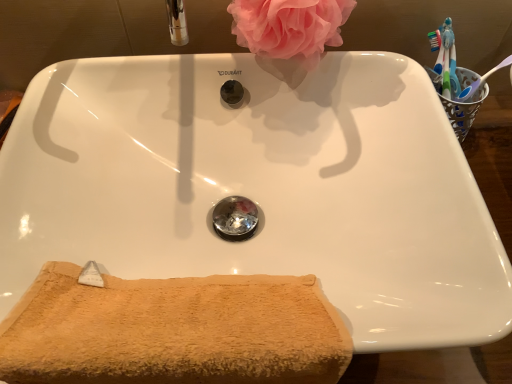
Question: Considering the positions of pink fluffy sponge at upper center and beige terry cloth towel at lower left in the image, is pink fluffy sponge at upper center taller or shorter than beige terry cloth towel at lower left?

Choices:
 (A) tall
 (B) short

Answer: (B)

Question: In terms of width, does pink fluffy sponge at upper center look wider or thinner when compared to beige terry cloth towel at lower left?

Choices:
 (A) thin
 (B) wide

Answer: (B)

Question: From a real-world perspective, is pink fluffy sponge at upper center positioned above or below beige terry cloth towel at lower left?

Choices:
 (A) below
 (B) above

Answer: (B)

Question: In terms of width, does beige terry cloth towel at lower left look wider or thinner when compared to pink fluffy sponge at upper center?

Choices:
 (A) thin
 (B) wide

Answer: (A)

Question: Does point (65, 349) appear closer or farther from the camera than point (271, 33)?

Choices:
 (A) farther
 (B) closer

Answer: (B)

Question: Based on their positions, is beige terry cloth towel at lower left located to the left or right of pink fluffy sponge at upper center?

Choices:
 (A) left
 (B) right

Answer: (A)

Question: Is beige terry cloth towel at lower left spatially inside pink fluffy sponge at upper center, or outside of it?

Choices:
 (A) inside
 (B) outside

Answer: (B)